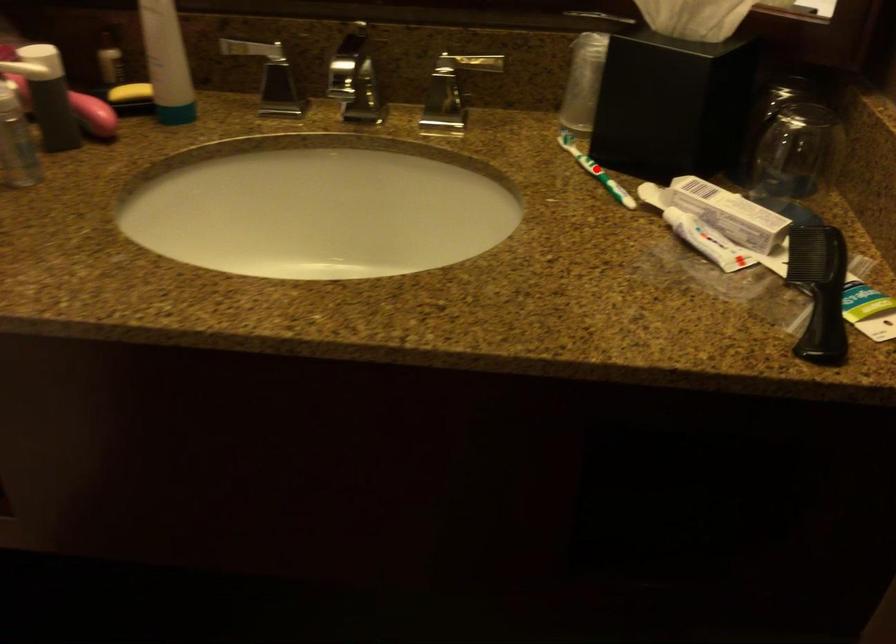
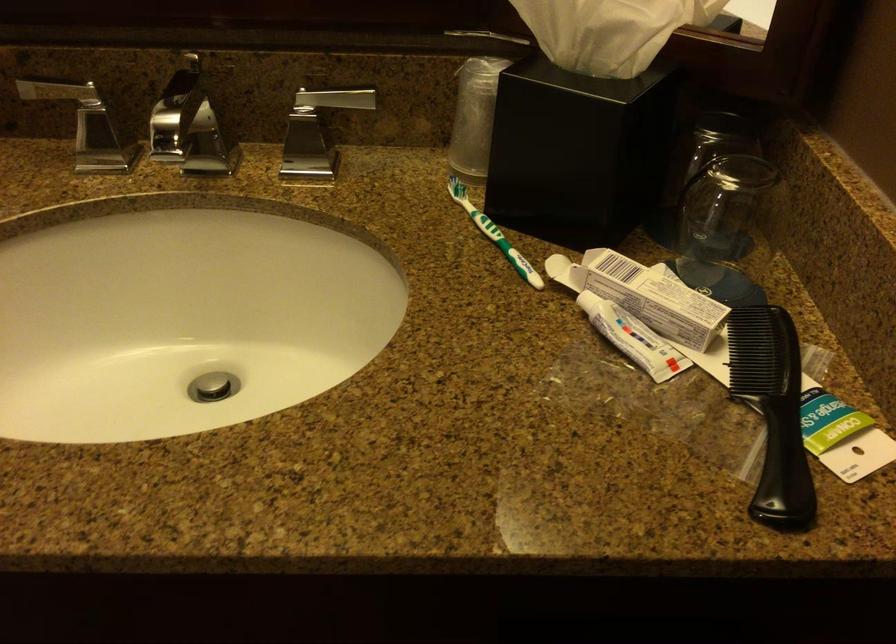
The point at the highlighted location is marked in the first image. Where is the corresponding point in the second image?

(494, 234)